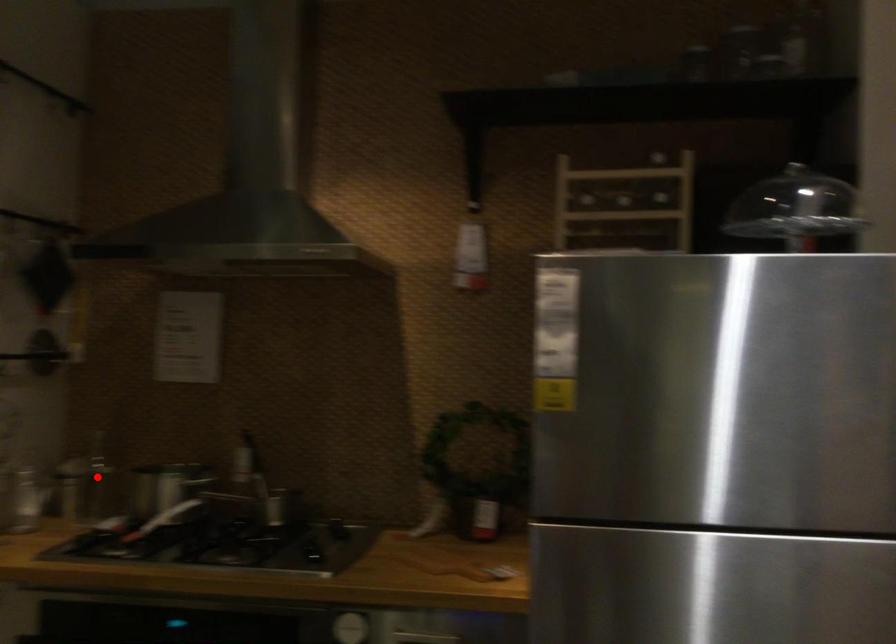
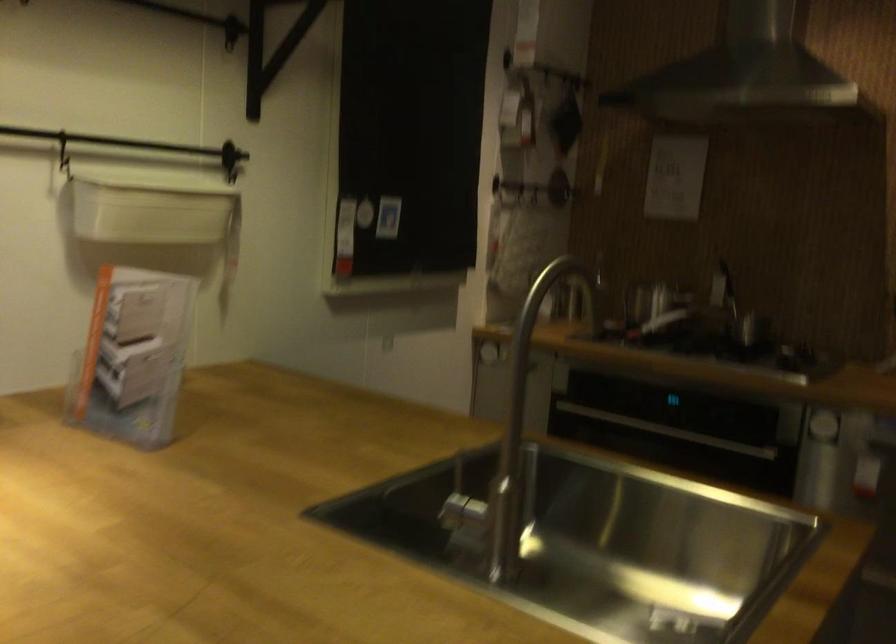
Question: I am providing you with two images of the same scene from different viewpoints. A red point is marked on the first image. At the location where the point appears in image 1, is it still visible in image 2?

Choices:
 (A) Yes
 (B) No

Answer: (B)